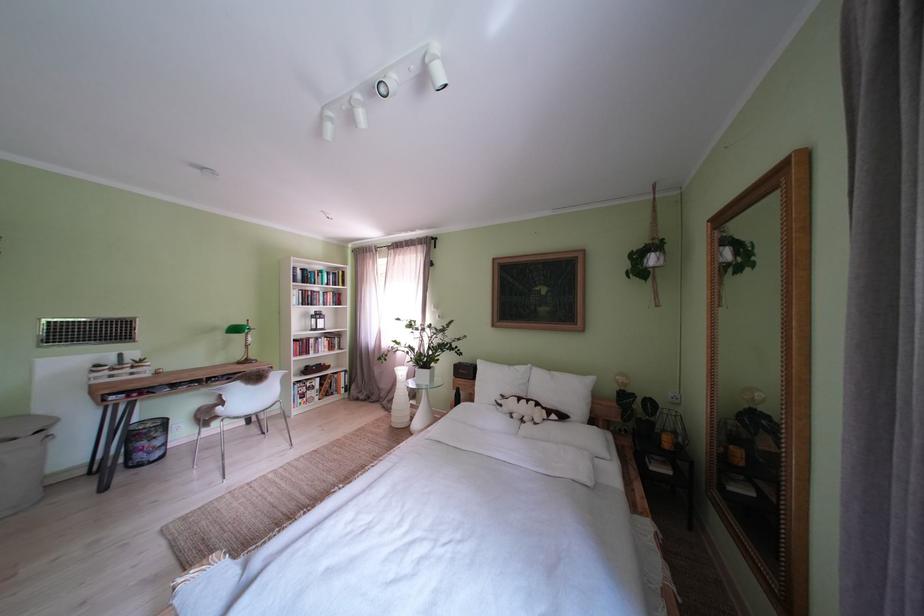
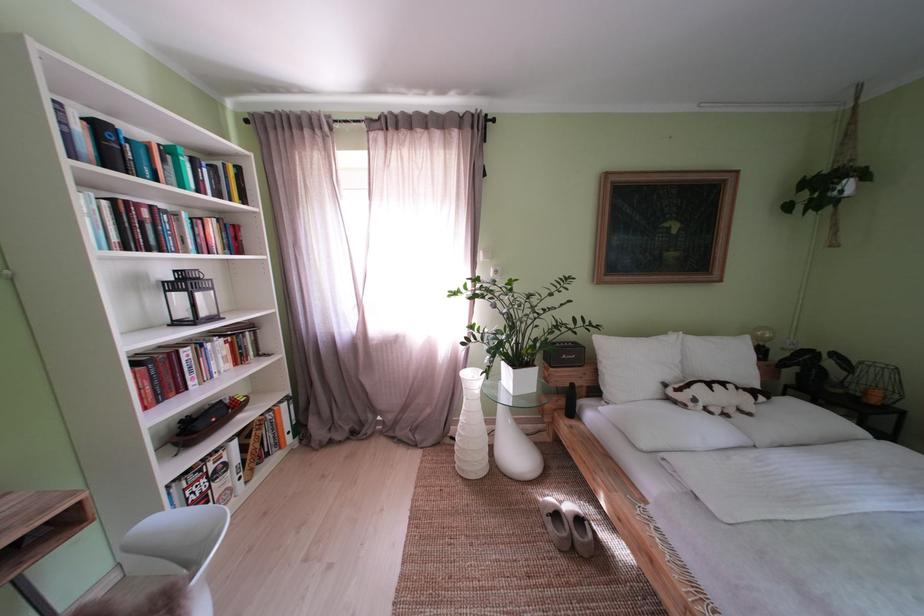
Find the pixel in the second image that matches point 322,346 in the first image.

(199, 359)